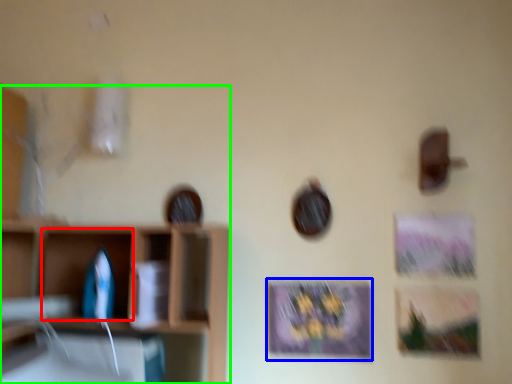
Question: Considering the real-world distances, which object is closest to cabinet (highlighted by a red box)? picture frame (highlighted by a blue box) or shelf (highlighted by a green box).

Choices:
 (A) picture frame
 (B) shelf

Answer: (B)